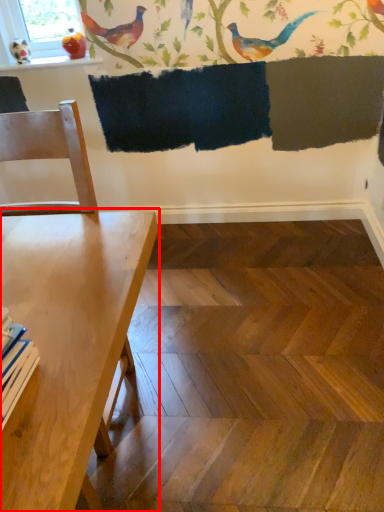
Question: From the image's perspective, what is the correct spatial relationship of table (annotated by the red box) in relation to bird?

Choices:
 (A) below
 (B) above

Answer: (A)